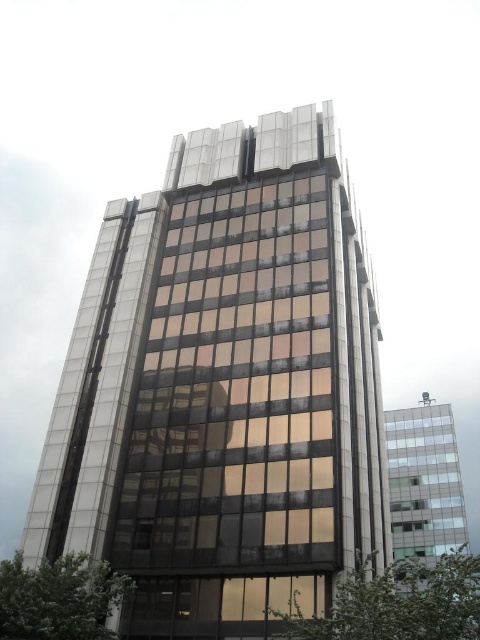
Question: Which point appears closest to the camera in this image?

Choices:
 (A) (124, 552)
 (B) (458, 481)

Answer: (A)

Question: Which point is farther to the camera?

Choices:
 (A) pos(403,541)
 (B) pos(108,388)

Answer: (A)

Question: Can you confirm if glassy reflective building at center is thinner than clear glass building at right?

Choices:
 (A) no
 (B) yes

Answer: (B)

Question: Is glassy reflective building at center positioned at the back of clear glass building at right?

Choices:
 (A) yes
 (B) no

Answer: (A)

Question: Considering the relative positions of glassy reflective building at center and clear glass building at right in the image provided, where is glassy reflective building at center located with respect to clear glass building at right?

Choices:
 (A) right
 (B) left

Answer: (B)